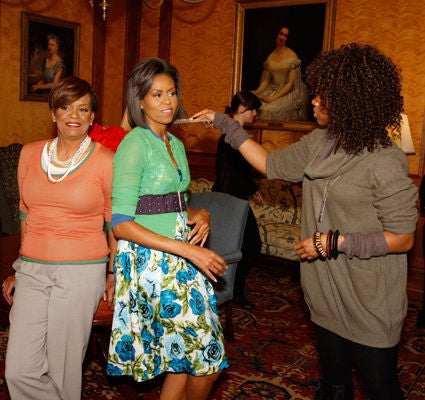
Locate an element on the screen. Image resolution: width=425 pixels, height=400 pixels. bottom of chandelier is located at coordinates (104, 15).